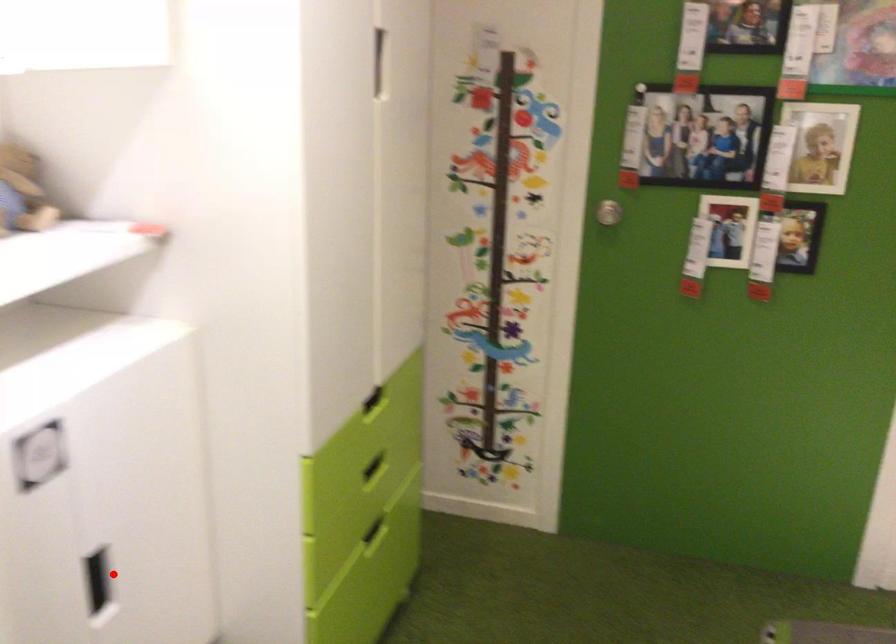
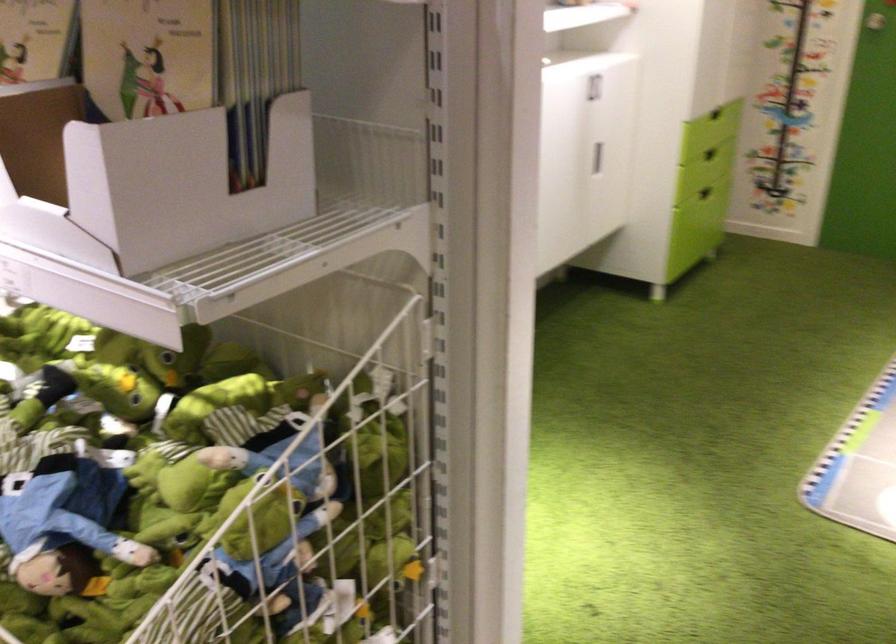
In the second image, find the point that corresponds to the highlighted location in the first image.

(597, 158)